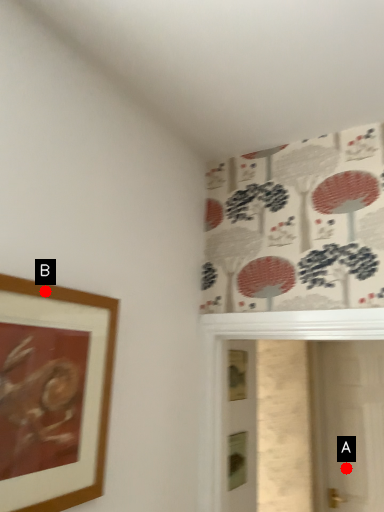
Question: Two points are circled on the image, labeled by A and B beside each circle. Which point is farther to the camera?

Choices:
 (A) A is further
 (B) B is further

Answer: (A)